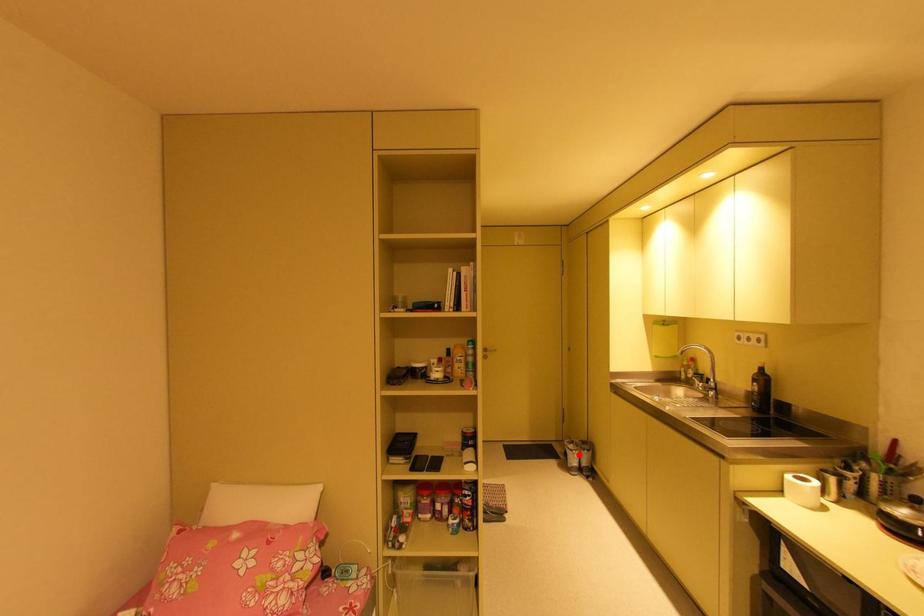
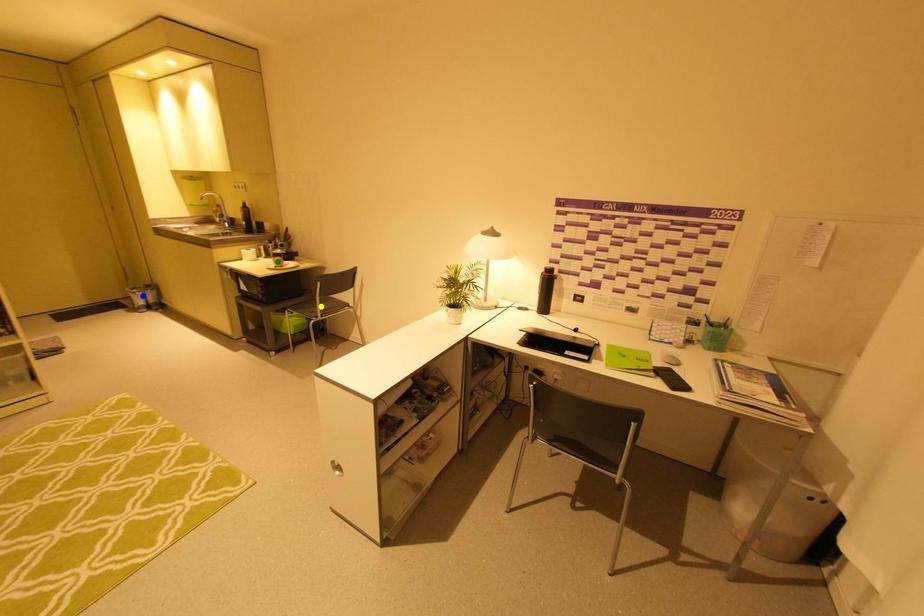
Question: I am providing you with two images of the same scene from different viewpoints. A red point is marked on the first image. You are given multiple points on the second image. In image 2, which mark is for the same physical point as the one in image 1?

Choices:
 (A) blue point
 (B) green point
 (C) yellow point

Answer: (A)